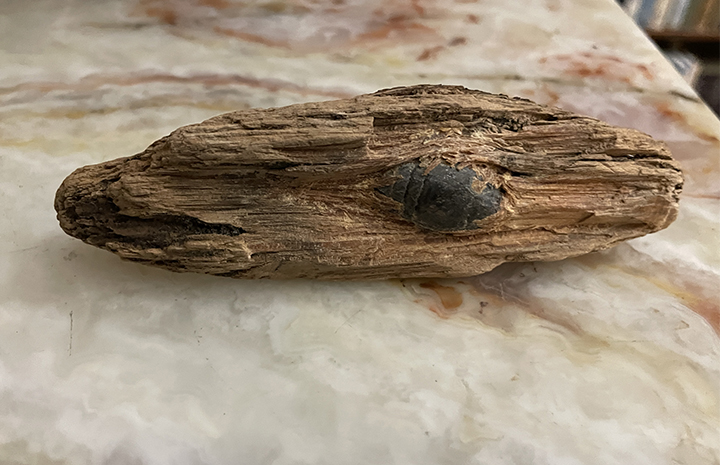
You are a GUI agent. You are given a task and a screenshot of the screen. Output one action in this format:
    pyautogui.click(x=<x>, y=<y>)
    Task: Click on the countertop
    The image size is (720, 465).
    Given the screenshot: What is the action you would take?
    pyautogui.click(x=340, y=384)